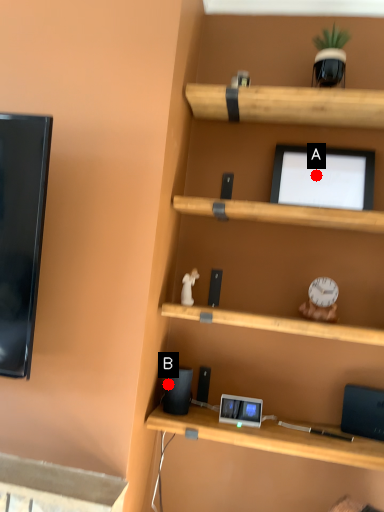
Question: Two points are circled on the image, labeled by A and B beside each circle. Which point is farther from the camera taking this photo?

Choices:
 (A) A is further
 (B) B is further

Answer: (A)